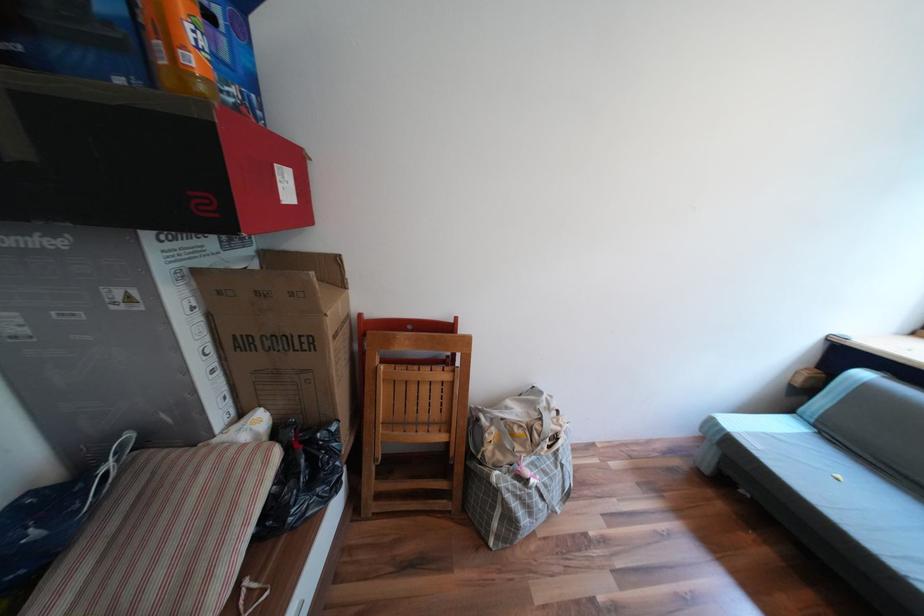
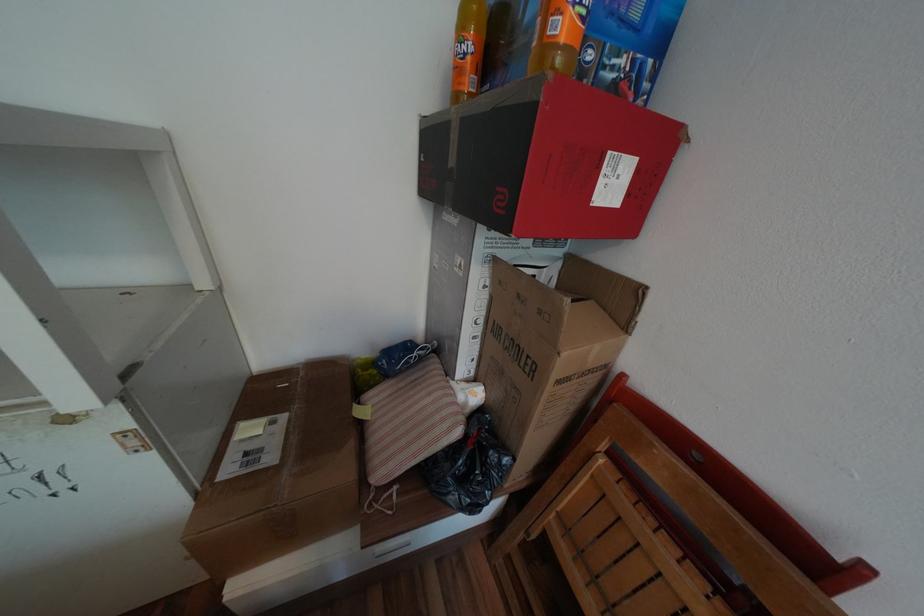
Find the pixel in the second image that matches point (258, 464) in the first image.

(453, 419)